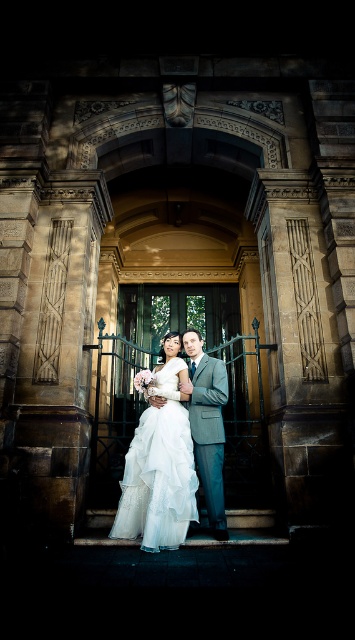
Question: Is the position of white tulle dress at center less distant than that of light gray suit at center?

Choices:
 (A) no
 (B) yes

Answer: (B)

Question: Is white tulle dress at center wider than light gray suit at center?

Choices:
 (A) no
 (B) yes

Answer: (B)

Question: Which point is farther to the camera?

Choices:
 (A) white tulle dress at center
 (B) light gray suit at center

Answer: (B)

Question: Among these objects, which one is nearest to the camera?

Choices:
 (A) white tulle dress at center
 (B) light gray suit at center

Answer: (A)

Question: Is white tulle dress at center bigger than light gray suit at center?

Choices:
 (A) yes
 (B) no

Answer: (A)